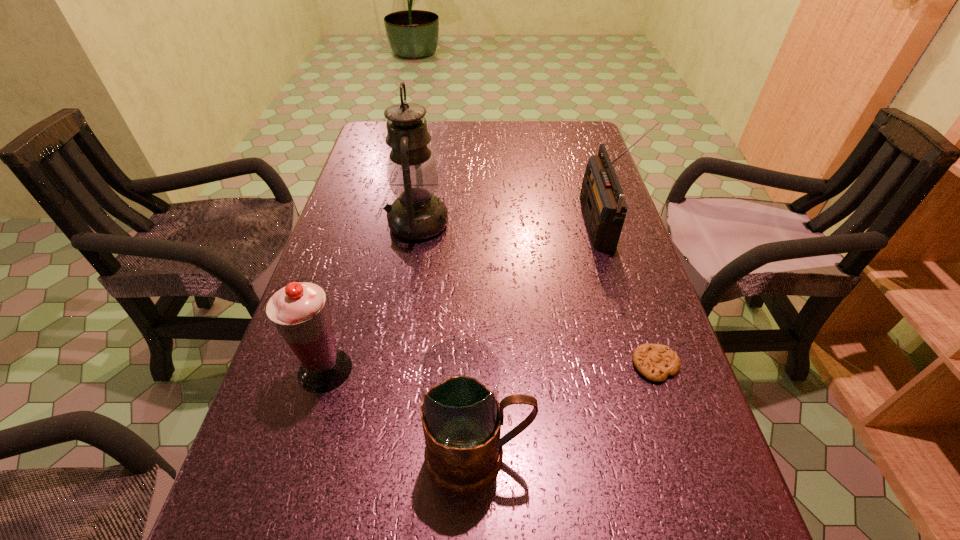
Locate an element on the screen. The height and width of the screenshot is (540, 960). oil lamp is located at coordinates click(x=417, y=214).

At what (x,y) coordinates should I click in order to perform the action: click on radio receiver. Please return your answer as a coordinate pair (x, y). Looking at the image, I should click on (602, 198).

The height and width of the screenshot is (540, 960). Identify the location of smoothie. (299, 311).

I want to click on the nearest object, so click(x=459, y=378).

Locate an element on the screen. the shortest object is located at coordinates (655, 362).

The height and width of the screenshot is (540, 960). Find the location of `vacant space located on the front of the oil lamp`. vacant space located on the front of the oil lamp is located at coordinates (400, 327).

What are the coordinates of `vacant space located 0.100m on the front-facing side of the radio receiver` in the screenshot? It's located at (548, 225).

Find the location of a particular element. This screenshot has width=960, height=540. free space located on the front-facing side of the radio receiver is located at coordinates (540, 225).

Find the location of a particular element. Image resolution: width=960 pixels, height=540 pixels. blank space located 0.400m on the front-facing side of the radio receiver is located at coordinates (433, 225).

This screenshot has width=960, height=540. I want to click on vacant space located 0.200m on the back of the smoothie, so click(x=352, y=278).